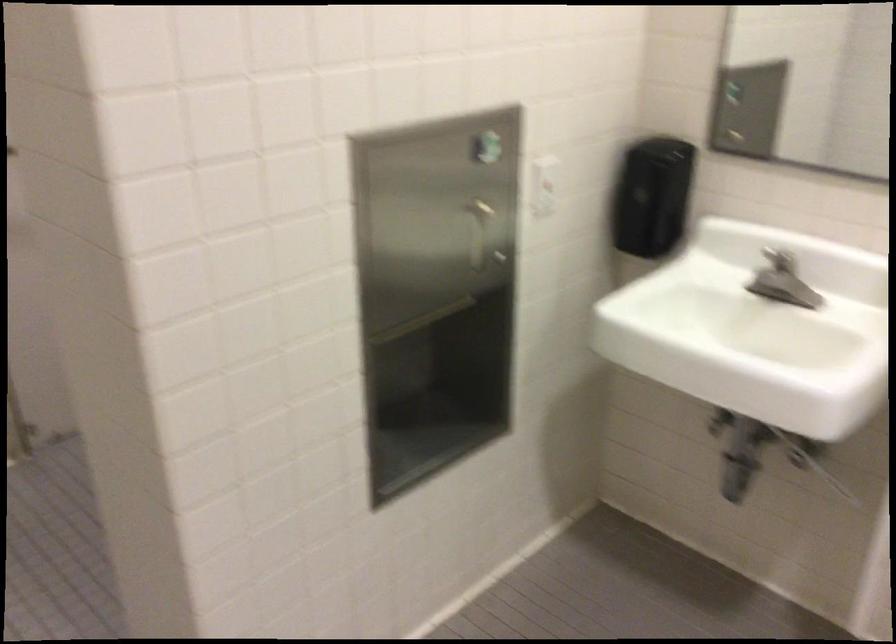
Describe the element at coordinates (782, 281) in the screenshot. I see `the metal faucet handle` at that location.